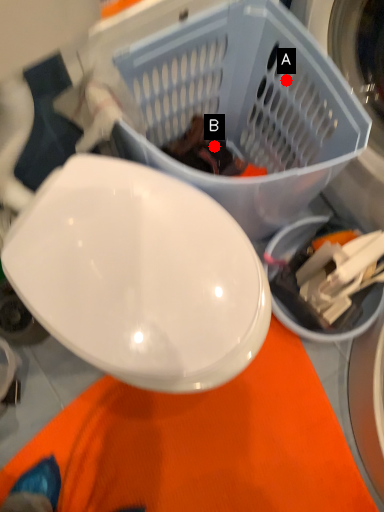
Question: Two points are circled on the image, labeled by A and B beside each circle. Which point is closer to the camera taking this photo?

Choices:
 (A) A is closer
 (B) B is closer

Answer: (A)